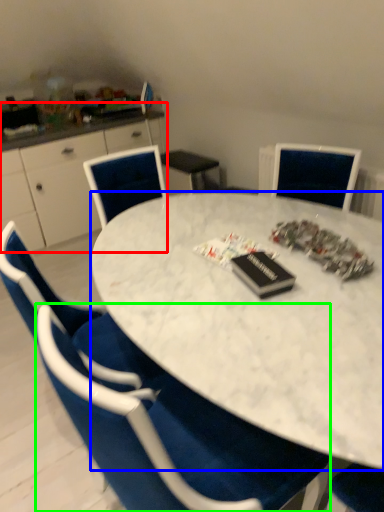
Question: Estimate the real-world distances between objects in this image. Which object is farther from computer desk (highlighted by a red box), desk (highlighted by a blue box) or chair (highlighted by a green box)?

Choices:
 (A) desk
 (B) chair

Answer: (B)